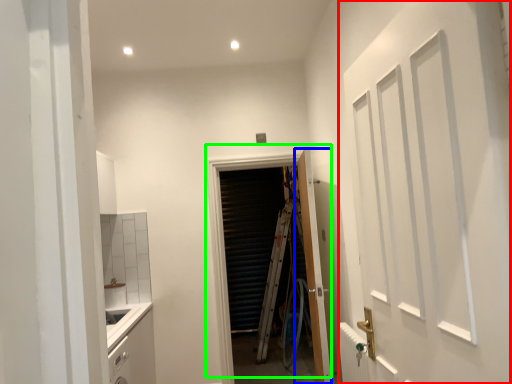
Question: Which is farther away from door (highlighted by a red box)? door (highlighted by a blue box) or door (highlighted by a green box)?

Choices:
 (A) door
 (B) door

Answer: (B)